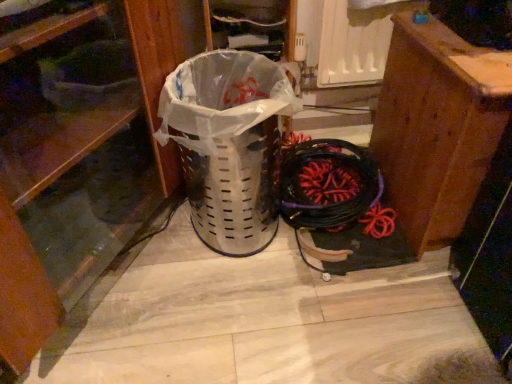
Question: Is brown wood cabinet at right wider or thinner than brushed wood dresser at left?

Choices:
 (A) thin
 (B) wide

Answer: (A)

Question: From their relative heights in the image, would you say brown wood cabinet at right is taller or shorter than brushed wood dresser at left?

Choices:
 (A) short
 (B) tall

Answer: (A)

Question: In the image, is brown wood cabinet at right on the left side or the right side of brushed wood dresser at left?

Choices:
 (A) right
 (B) left

Answer: (A)

Question: Is brushed wood dresser at left inside or outside of brown wood cabinet at right?

Choices:
 (A) inside
 (B) outside

Answer: (B)

Question: From a real-world perspective, is brushed wood dresser at left above or below brown wood cabinet at right?

Choices:
 (A) below
 (B) above

Answer: (B)

Question: Considering the positions of point (80, 158) and point (465, 97), is point (80, 158) closer or farther from the camera than point (465, 97)?

Choices:
 (A) closer
 (B) farther

Answer: (B)

Question: In terms of height, does brushed wood dresser at left look taller or shorter compared to brown wood cabinet at right?

Choices:
 (A) short
 (B) tall

Answer: (B)